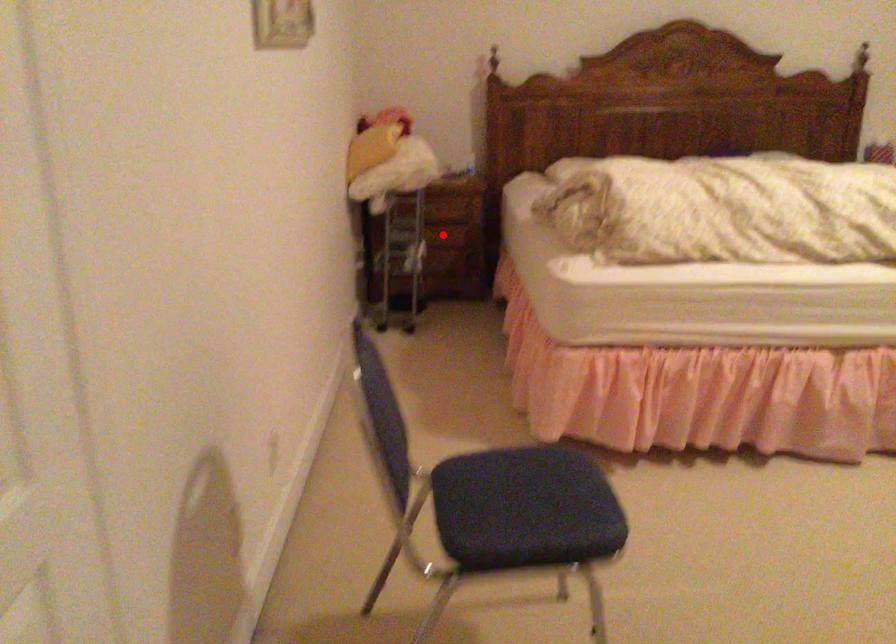
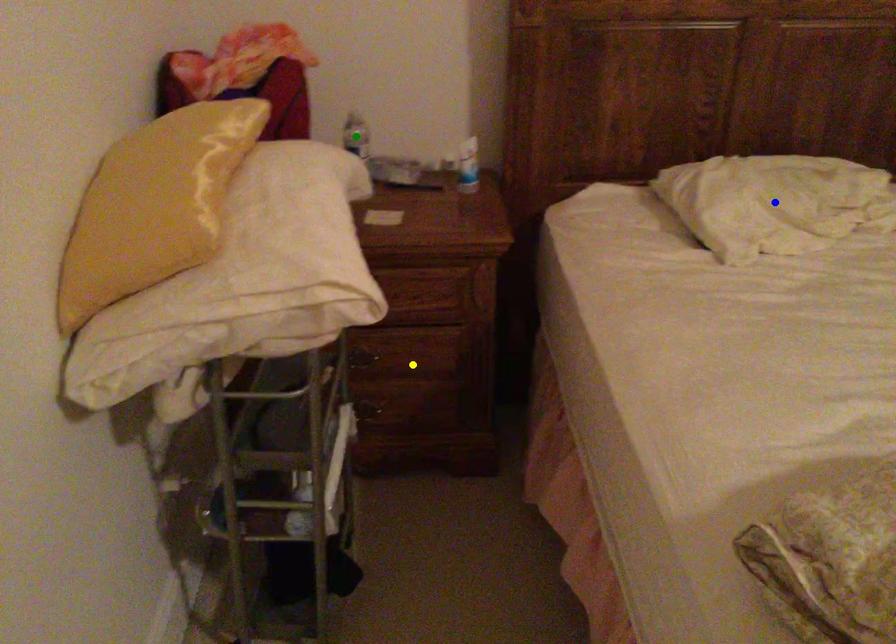
Question: I am providing you with two images of the same scene from different viewpoints. A red point is marked on the first image. You are given multiple points on the second image. Which spot in image 2 lines up with the point in image 1?

Choices:
 (A) green point
 (B) yellow point
 (C) blue point

Answer: (B)